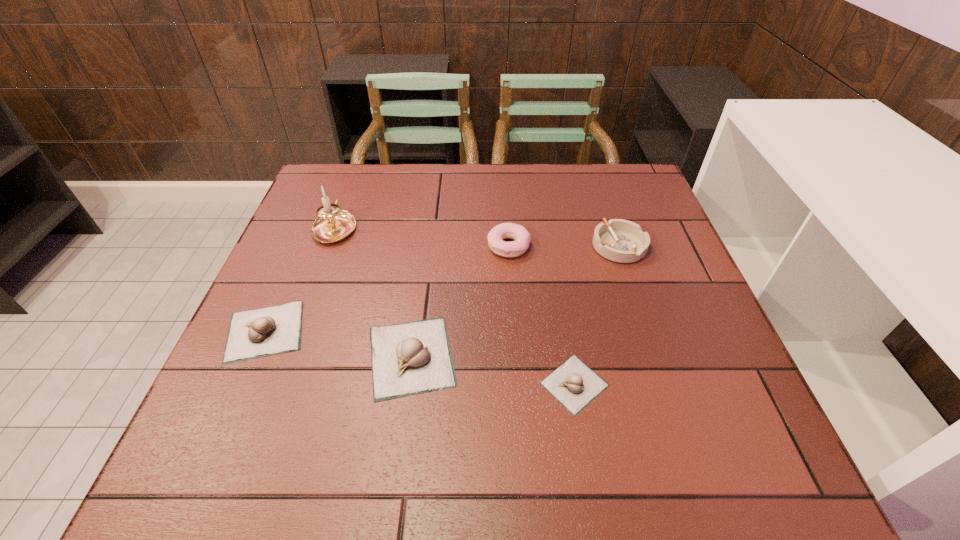
Find the location of a particular element. vacant region located 0.140m on the back of the doughnut is located at coordinates (505, 201).

I want to click on vacant space located 0.250m on the handle side of the tallest object, so click(359, 163).

At what (x,y) coordinates should I click in order to perform the action: click on vacant area situated on the handle side of the tallest object. Please return your answer as a coordinate pair (x, y). Looking at the image, I should click on (348, 193).

Find the location of a particular element. The image size is (960, 540). vacant space situated 0.080m on the handle side of the tallest object is located at coordinates (348, 193).

Locate an element on the screen. vacant space located 0.100m on the left of the rightmost object is located at coordinates (553, 246).

Locate an element on the screen. The image size is (960, 540). garlic present at the left edge is located at coordinates pyautogui.click(x=255, y=333).

Locate an element on the screen. The width and height of the screenshot is (960, 540). candle holder situated at the left edge is located at coordinates (333, 224).

I want to click on object that is at the right edge, so click(623, 241).

Where is `vacant region at the far edge of the desktop`? vacant region at the far edge of the desktop is located at coordinates (583, 191).

In the image, there is a desktop. Identify the location of vacant region at the near edge. This screenshot has height=540, width=960. (472, 381).